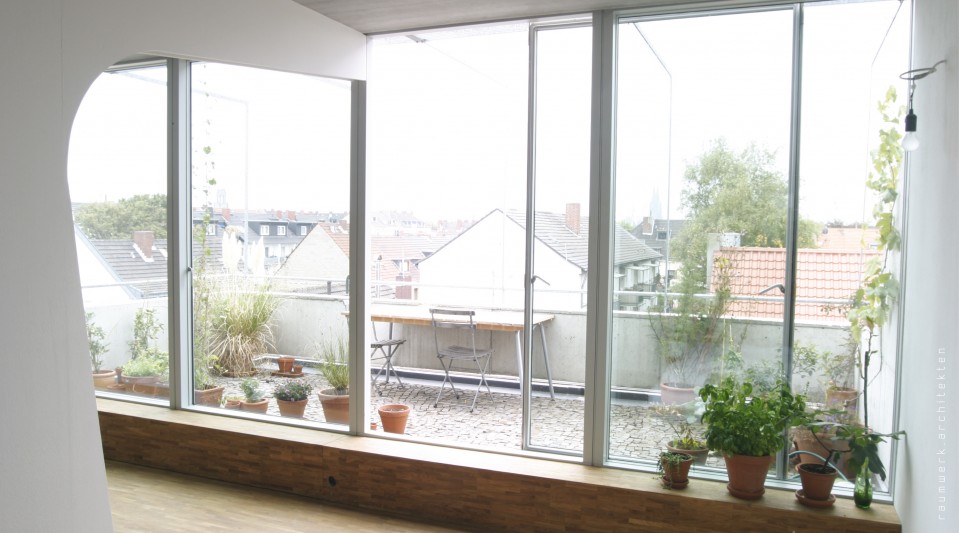
At what (x,y) coordinates should I click in order to perform the action: click on frame. Please return your answer as a coordinate pair (x, y). Looking at the image, I should click on (363, 306), (601, 272).